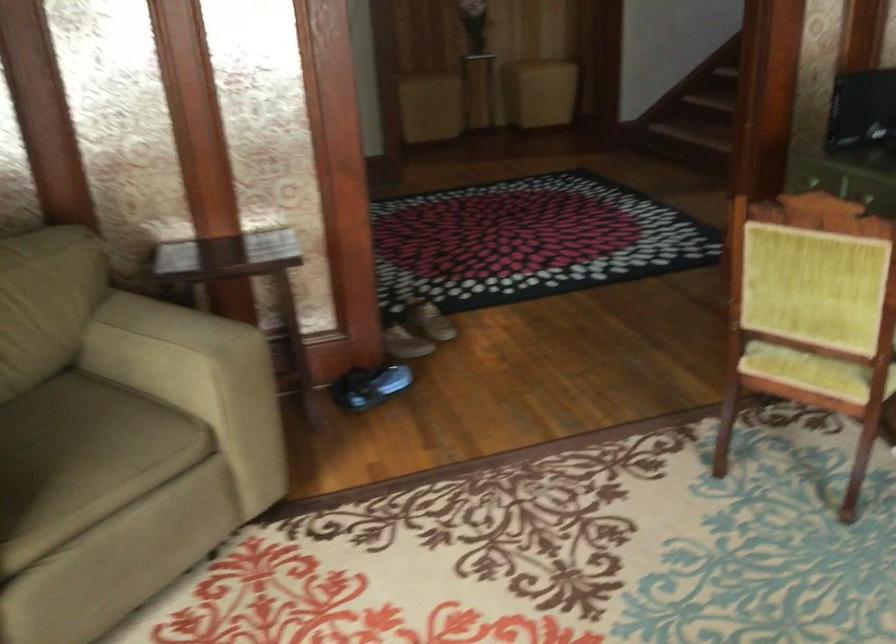
The image size is (896, 644). Describe the element at coordinates (82, 459) in the screenshot. I see `the sofa sitting surface` at that location.